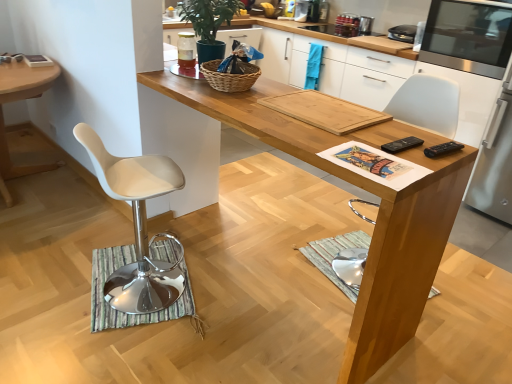
You are a GUI agent. You are given a task and a screenshot of the screen. Output one action in this format:
    pyautogui.click(x=<x>, y=<y>)
    Task: Click on the unoccupied area behind light brown wood desk at center, the 2th desk viewed from the left
    The image size is (512, 384).
    Given the screenshot: What is the action you would take?
    pyautogui.click(x=284, y=203)